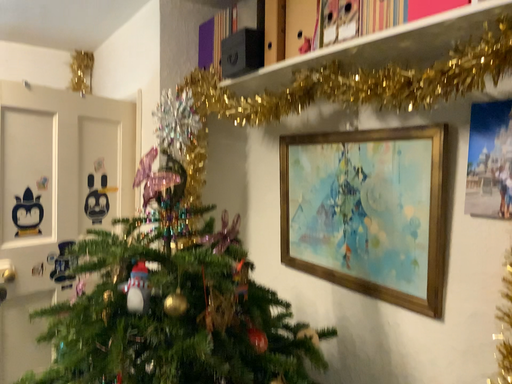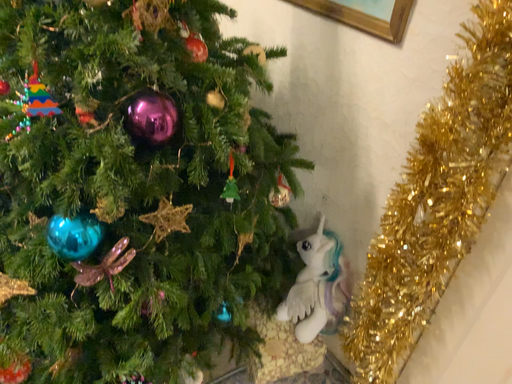
Question: Which way did the camera rotate in the video?

Choices:
 (A) rotated downward
 (B) rotated upward

Answer: (A)